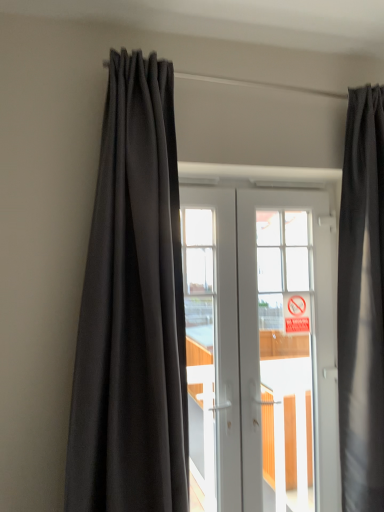
Question: Does white glossy door at center have a larger size compared to red plastic sign at center?

Choices:
 (A) yes
 (B) no

Answer: (A)

Question: Is white glossy door at center shorter than red plastic sign at center?

Choices:
 (A) no
 (B) yes

Answer: (A)

Question: From a real-world perspective, is white glossy door at center under red plastic sign at center?

Choices:
 (A) yes
 (B) no

Answer: (A)

Question: Is white glossy door at center in contact with red plastic sign at center?

Choices:
 (A) no
 (B) yes

Answer: (A)

Question: From a real-world perspective, is white glossy door at center physically above red plastic sign at center?

Choices:
 (A) yes
 (B) no

Answer: (B)

Question: Is white glossy door at center outside red plastic sign at center?

Choices:
 (A) no
 (B) yes

Answer: (B)

Question: Is red plastic sign at center at the right side of white glossy door at center?

Choices:
 (A) yes
 (B) no

Answer: (A)

Question: Considering the relative sizes of red plastic sign at center and white glossy door at center in the image provided, is red plastic sign at center bigger than white glossy door at center?

Choices:
 (A) yes
 (B) no

Answer: (B)

Question: Is white glossy door at center surrounded by red plastic sign at center?

Choices:
 (A) no
 (B) yes

Answer: (A)

Question: From the image's perspective, is red plastic sign at center on white glossy door at center?

Choices:
 (A) yes
 (B) no

Answer: (A)

Question: Is red plastic sign at center completely or partially outside of white glossy door at center?

Choices:
 (A) yes
 (B) no

Answer: (B)

Question: Is red plastic sign at center shorter than white glossy door at center?

Choices:
 (A) no
 (B) yes

Answer: (B)

Question: Is red plastic sign at center oriented towards dark gray fabric curtain at left, which is the 1th curtain from left to right?

Choices:
 (A) yes
 (B) no

Answer: (B)